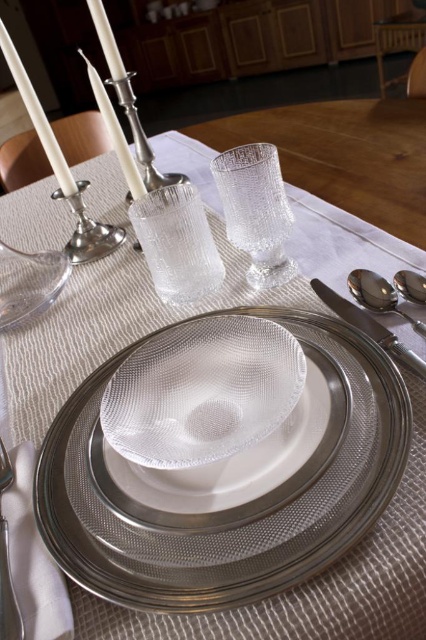
You are a server at a formal dinner and need to place a napkin that is 5 inches wide between the clear textured glass at center and the satin silver spoon at upper right. Will the napkin fit without overlapping either item?

The distance between the clear textured glass at center and the satin silver spoon at upper right is 4.50 inches. Since the napkin is 5 inches wide, it will not fit without overlapping the items.

You are a guest at this formal dinner and you want to use the spoon closest to you. Which one should you choose between the satin silver spoon at lower right and the satin silver spoon at upper right?

The satin silver spoon at lower right is positioned under the satin silver spoon at upper right, so the one closer to you would be the satin silver spoon at lower right.

You are a guest at a formal dinner and see two satin silver spoons on the table. Which one is taller, the satin silver spoon at lower right or the satin silver spoon at upper right?

The satin silver spoon at lower right is taller than the satin silver spoon at upper right.